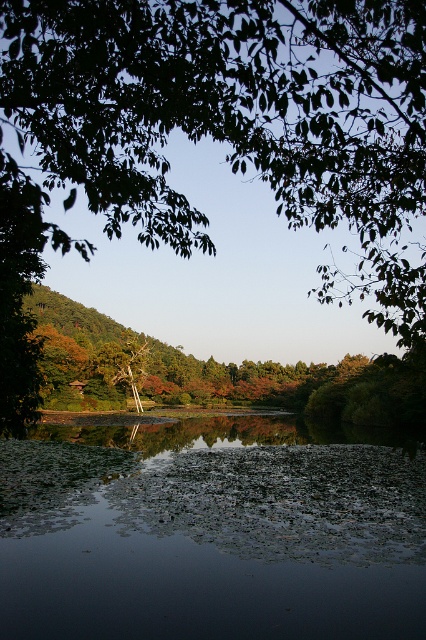
Is green leafy tree at upper center shorter than smooth brown tree trunk at center?

No, green leafy tree at upper center is not shorter than smooth brown tree trunk at center.

Where is `green leafy tree at upper center`? This screenshot has height=640, width=426. green leafy tree at upper center is located at coordinates (236, 118).

Between point (333, 196) and point (97, 358), which one is positioned behind?

The point (97, 358) is behind.

At what (x,y) coordinates should I click in order to perform the action: click on green leafy tree at upper center. Please return your answer as a coordinate pair (x, y). Image resolution: width=426 pixels, height=640 pixels. Looking at the image, I should click on (236, 118).

Is green leafy tree at upper center smaller than green leafy river at center?

No.

Can you confirm if green leafy tree at upper center is positioned below green leafy river at center?

No.

The image size is (426, 640). Find the location of `green leafy tree at upper center`. green leafy tree at upper center is located at coordinates (x=236, y=118).

The image size is (426, 640). I want to click on green leafy river at center, so click(x=210, y=534).

Can you confirm if green leafy river at center is thinner than smooth brown tree trunk at center?

No.

Is point (374, 609) positioned in front of point (106, 348)?

Yes.

The image size is (426, 640). I want to click on green leafy river at center, so [x=210, y=534].